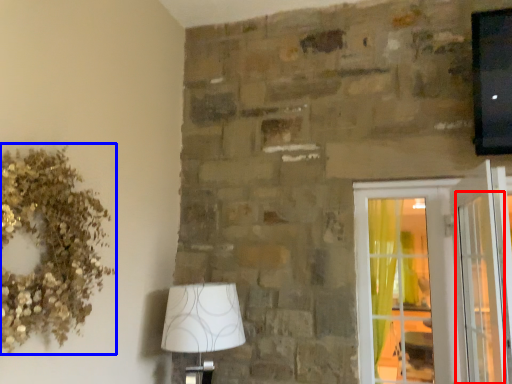
Question: Which point is further to the camera, screen door (highlighted by a red box) or floral arrangement (highlighted by a blue box)?

Choices:
 (A) screen door
 (B) floral arrangement

Answer: (A)